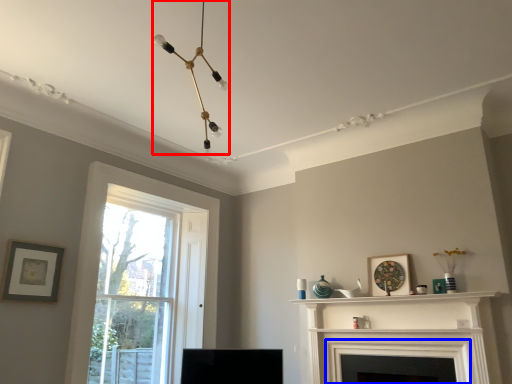
Question: Which point is further to the camera, light fixture (highlighted by a red box) or fireplace (highlighted by a blue box)?

Choices:
 (A) light fixture
 (B) fireplace

Answer: (B)